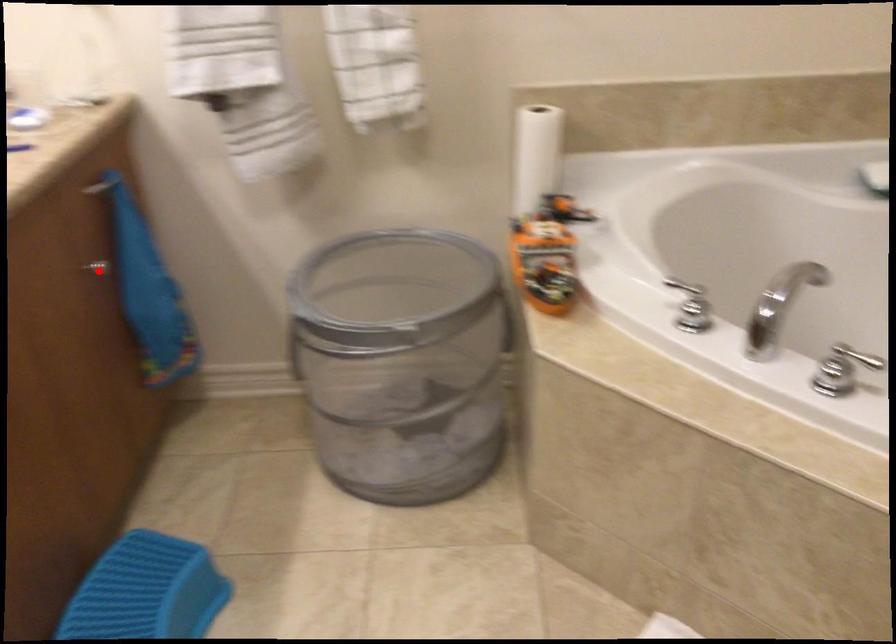
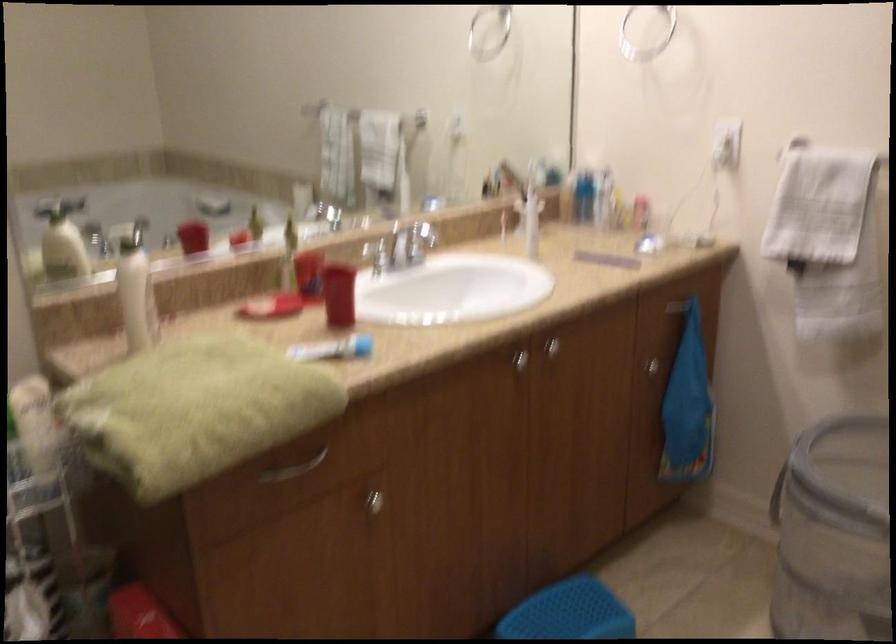
Question: I am providing you with two images of the same scene from different viewpoints. In image1, a red point is highlighted. Considering the same 3D point in image2, which of the following is correct?

Choices:
 (A) It is closer
 (B) It is farther

Answer: (B)